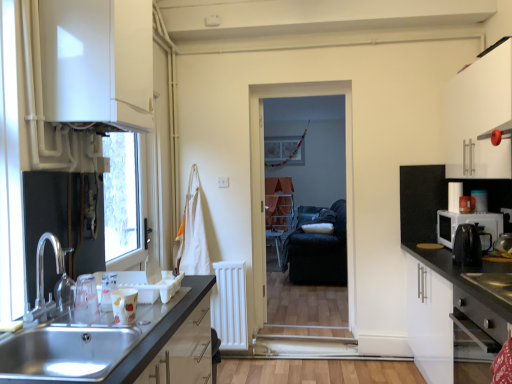
Question: Can you confirm if black plastic coffee machine at right is thinner than stainless steel oven at lower right?

Choices:
 (A) no
 (B) yes

Answer: (B)

Question: Is black plastic coffee machine at right turned away from stainless steel oven at lower right?

Choices:
 (A) yes
 (B) no

Answer: (B)

Question: Can you confirm if black plastic coffee machine at right is wider than stainless steel oven at lower right?

Choices:
 (A) no
 (B) yes

Answer: (A)

Question: Is black plastic coffee machine at right to the left of stainless steel oven at lower right from the viewer's perspective?

Choices:
 (A) no
 (B) yes

Answer: (A)

Question: Would you say black plastic coffee machine at right is a long distance from stainless steel oven at lower right?

Choices:
 (A) yes
 (B) no

Answer: (B)

Question: Looking at their shapes, would you say stainless steel oven at lower right is wider or thinner than white matte cabinet at right, positioned as the third cabinetry in top-to-bottom order?

Choices:
 (A) thin
 (B) wide

Answer: (A)

Question: Considering the positions of stainless steel oven at lower right and white matte cabinet at right, positioned as the third cabinetry in top-to-bottom order, in the image, is stainless steel oven at lower right bigger or smaller than white matte cabinet at right, positioned as the third cabinetry in top-to-bottom order,?

Choices:
 (A) big
 (B) small

Answer: (B)

Question: Is stainless steel oven at lower right to the left or to the right of white matte cabinet at right, which is counted as the 2th cabinetry, starting from the left, in the image?

Choices:
 (A) right
 (B) left

Answer: (B)

Question: From a real-world perspective, is stainless steel oven at lower right physically located above or below white matte cabinet at right, positioned as the third cabinetry in top-to-bottom order?

Choices:
 (A) above
 (B) below

Answer: (A)

Question: In the image, is wooden table at center on the left side or the right side of white matte cabinet at upper right, which appears as the third cabinetry when viewed from the left?

Choices:
 (A) left
 (B) right

Answer: (A)

Question: From the image's perspective, is wooden table at center positioned above or below white matte cabinet at upper right, arranged as the 2th cabinetry when ordered from the bottom?

Choices:
 (A) above
 (B) below

Answer: (B)

Question: Is wooden table at center taller or shorter than white matte cabinet at upper right, which appears as the third cabinetry when viewed from the left?

Choices:
 (A) tall
 (B) short

Answer: (B)

Question: From a real-world perspective, is wooden table at center positioned above or below white matte cabinet at upper right, the first cabinetry viewed from the right?

Choices:
 (A) above
 (B) below

Answer: (B)

Question: Is black fabric armchair at center in front of or behind white glossy cabinet at upper left, marked as the third cabinetry in a bottom-to-top arrangement, in the image?

Choices:
 (A) behind
 (B) front

Answer: (A)

Question: Is point (344, 200) closer or farther from the camera than point (142, 41)?

Choices:
 (A) farther
 (B) closer

Answer: (A)